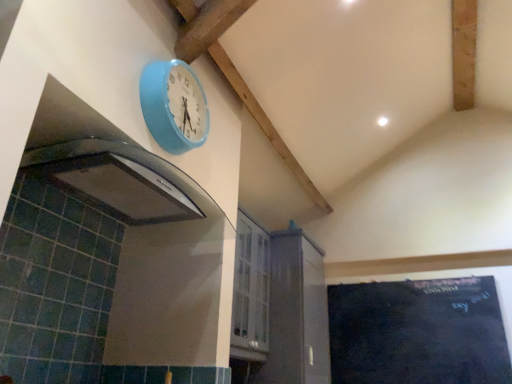
Locate an element on the screen. blank space above black chalkboard at lower right (from a real-world perspective) is located at coordinates (408, 279).